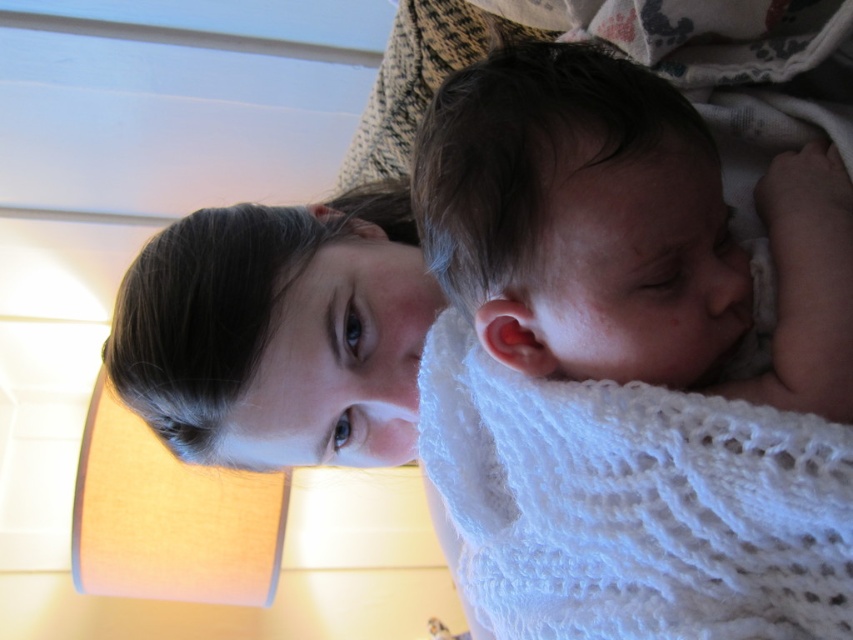
Question: Considering the real-world distances, which object is closest to the smooth white swaddling at right?

Choices:
 (A) smooth skin face at upper center
 (B) white knitted wrap at lower right

Answer: (B)

Question: Can you confirm if smooth white swaddling at right is thinner than white knitted wrap at lower right?

Choices:
 (A) no
 (B) yes

Answer: (A)

Question: Which object appears closest to the camera in this image?

Choices:
 (A) smooth white swaddling at right
 (B) white knitted wrap at lower right

Answer: (B)

Question: Can you confirm if smooth white swaddling at right is wider than white knitted wrap at lower right?

Choices:
 (A) yes
 (B) no

Answer: (A)

Question: Is white knitted wrap at lower right thinner than smooth skin face at upper center?

Choices:
 (A) no
 (B) yes

Answer: (B)

Question: Which object is farther from the camera taking this photo?

Choices:
 (A) smooth skin face at upper center
 (B) smooth white swaddling at right

Answer: (A)